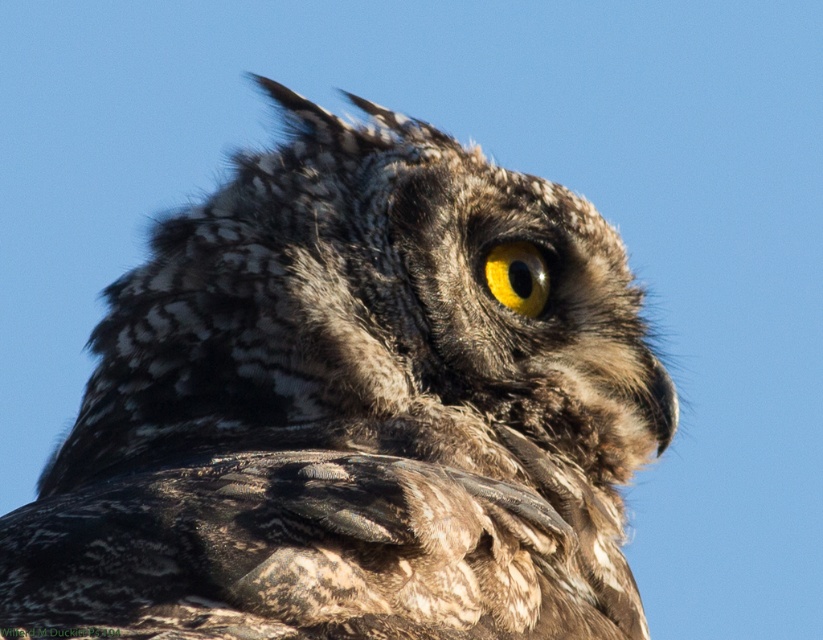
Consider the image. Can you confirm if speckled feathered owl at center is positioned to the left of yellow matte eye at center?

Indeed, speckled feathered owl at center is positioned on the left side of yellow matte eye at center.

Who is more forward, (335, 449) or (496, 260)?

Point (335, 449) is in front.

Does point (598, 232) come farther from viewer compared to point (533, 250)?

That is True.

The height and width of the screenshot is (640, 823). I want to click on speckled feathered owl at center, so click(350, 412).